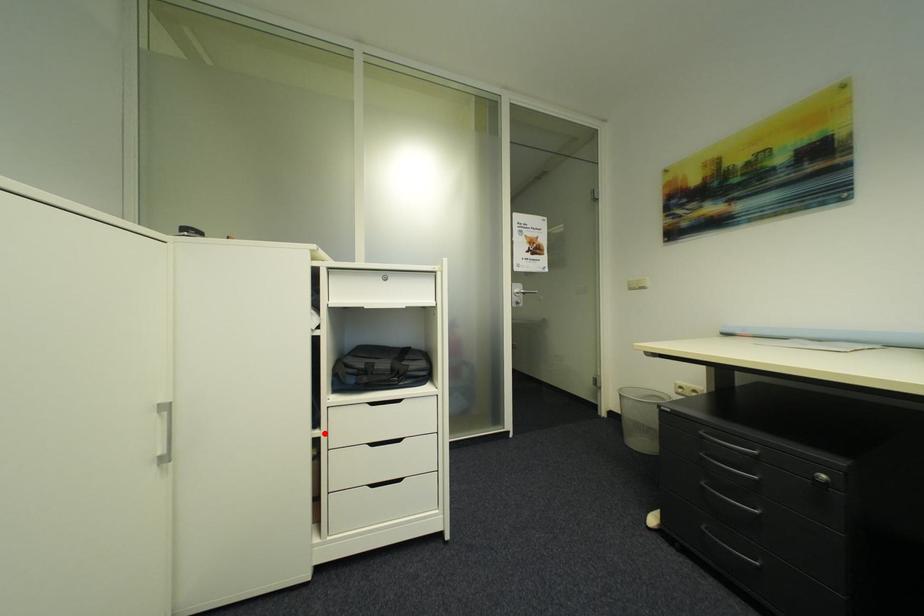
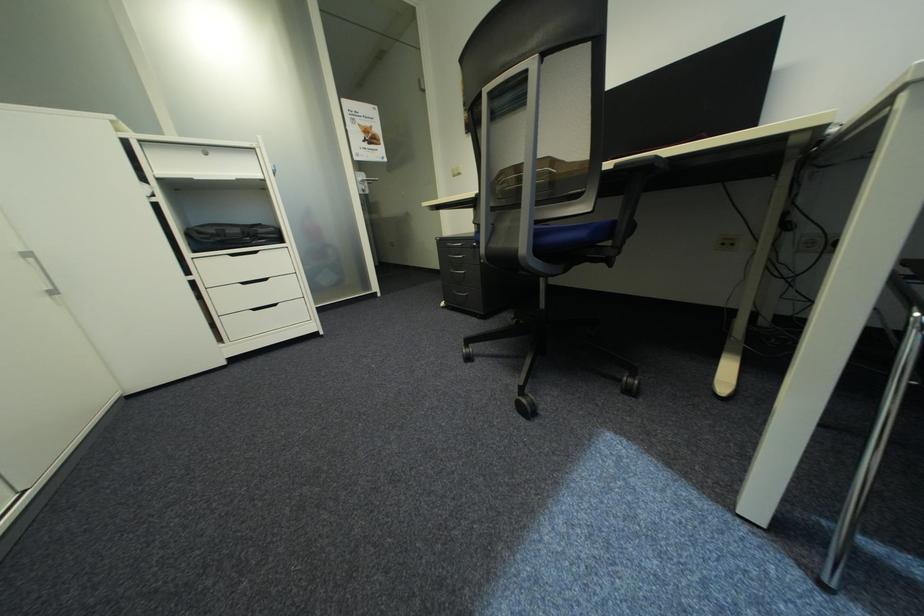
Find the pixel in the second image that matches the highlighted location in the first image.

(199, 278)